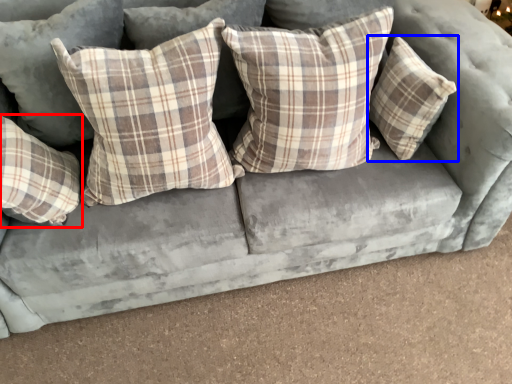
Question: Which of the following is the closest to the observer, pillow (highlighted by a red box) or pillow (highlighted by a blue box)?

Choices:
 (A) pillow
 (B) pillow

Answer: (A)